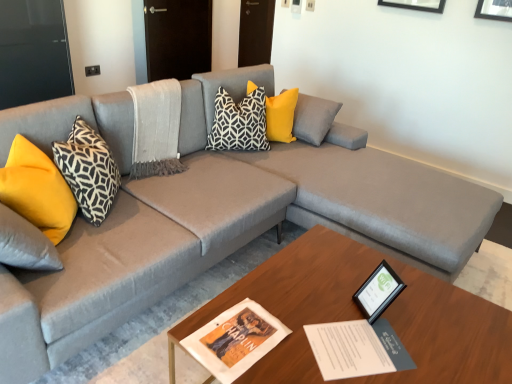
Find the location of `free spot behind white paper booklet at center`. free spot behind white paper booklet at center is located at coordinates (329, 294).